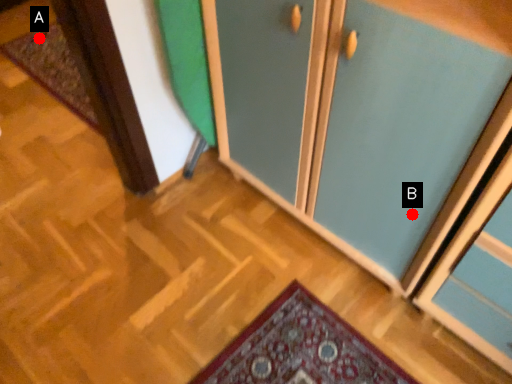
Question: Two points are circled on the image, labeled by A and B beside each circle. Which of the following is the farthest from the observer?

Choices:
 (A) A is further
 (B) B is further

Answer: (A)